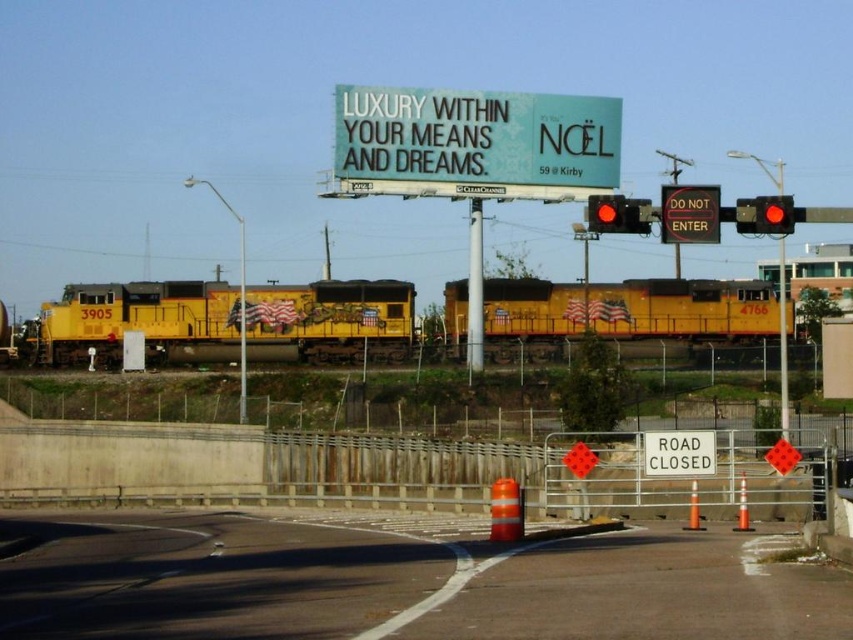
Question: Among these objects, which one is nearest to the camera?

Choices:
 (A) black plastic sign at upper center
 (B) white plastic road closed sign at center
 (C) smooth asphalt road at center

Answer: (C)

Question: Estimate the real-world distances between objects in this image. Which object is closer to the red glass traffic light at upper right?

Choices:
 (A) white plastic road closed sign at center
 (B) smooth asphalt road at center
 (C) white plastic billboard at upper center
 (D) yellow painted steel train at center

Answer: (A)

Question: In this image, where is smooth asphalt road at center located relative to red glass traffic light at upper right?

Choices:
 (A) right
 (B) left

Answer: (B)

Question: Does yellow matte train at center lie in front of black plastic sign at upper center?

Choices:
 (A) yes
 (B) no

Answer: (B)

Question: Does yellow matte train at center appear on the left side of white plastic billboard at upper center?

Choices:
 (A) no
 (B) yes

Answer: (B)

Question: Among these points, which one is farthest from the camera?

Choices:
 (A) (535, 284)
 (B) (766, 200)
 (C) (722, 317)
 (D) (434, 598)

Answer: (C)